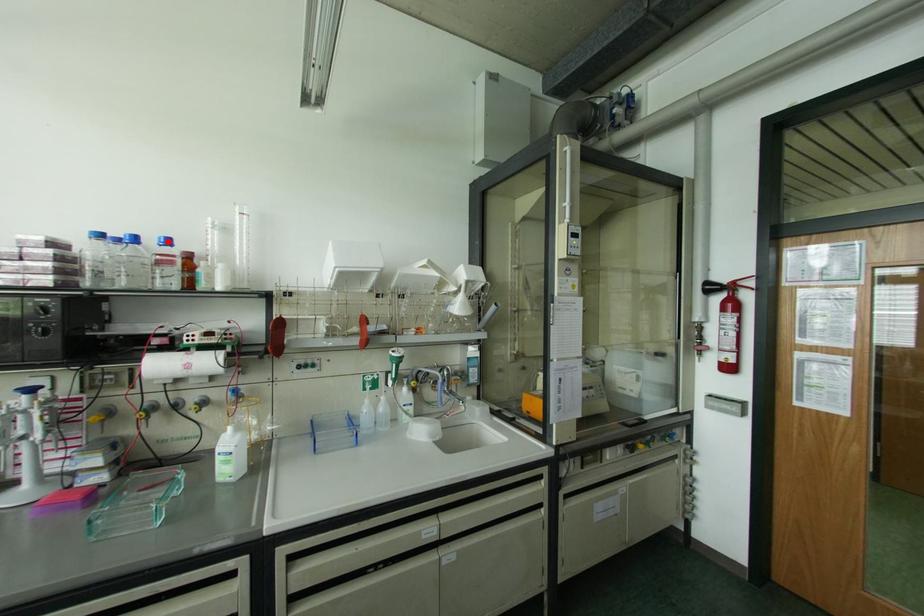
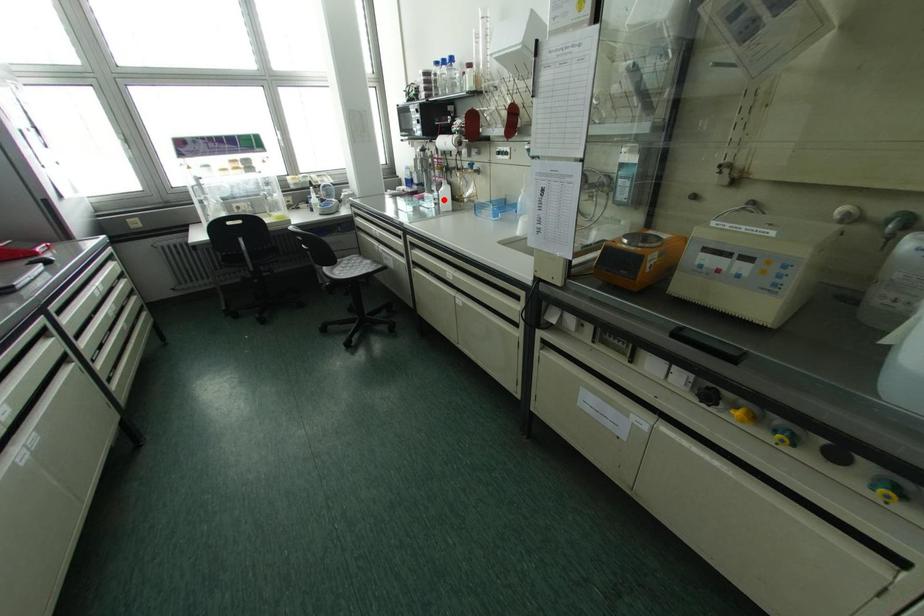
I am providing you with two images of the same scene from different viewpoints. A red point is marked on the first image and another point is marked on the second image. Do the highlighted points in image1 and image2 indicate the same real-world spot?

No